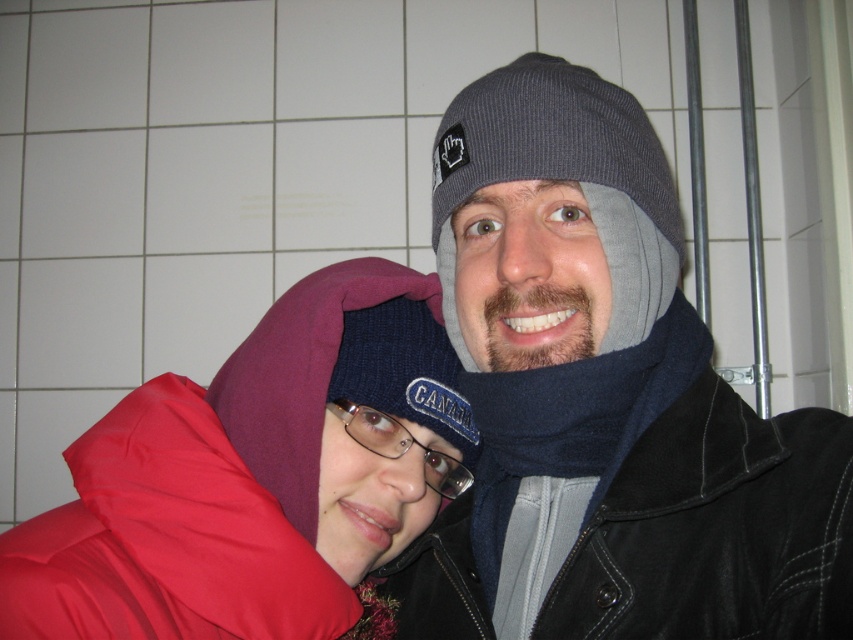
You are designing a display stand for a clothing store. The stand has two sections, one for jackets and one for accessories. You need to place the matte red jacket at lower left and the gray knit beanie at center in their respective sections. Given their sizes, which section requires more vertical space?

The matte red jacket at lower left requires more vertical space because it has a greater height compared to the gray knit beanie at center.

You are a photographer trying to capture a closeup shot of the matte red jacket at lower left and navy wool scarf at right. The camera can only focus on objects within 10 centimeters of each other. Can you take the photo without moving either item?

The matte red jacket at lower left is 12.73 centimeters from the navy wool scarf at right. Since the distance exceeds the camera focus range of 10 centimeters, you cannot take the photo without moving either item.